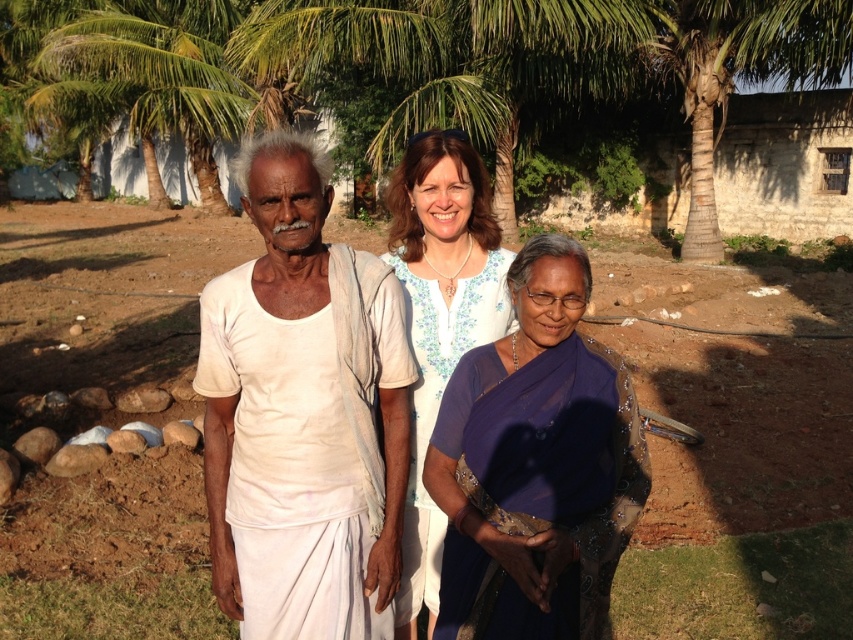
Can you confirm if purple sheer saree at center is positioned to the right of green leafy palm tree at upper left?

Yes, purple sheer saree at center is to the right of green leafy palm tree at upper left.

Can you confirm if purple sheer saree at center is positioned below green leafy palm tree at upper left?

Correct, purple sheer saree at center is located below green leafy palm tree at upper left.

Find the location of a particular element. purple sheer saree at center is located at coordinates (537, 465).

Consider the image. Can you confirm if green leafy tree at upper center is bigger than white floral dress at center?

Correct, green leafy tree at upper center is larger in size than white floral dress at center.

Looking at this image, who is positioned more to the right, green leafy tree at upper center or white floral dress at center?

Positioned to the right is white floral dress at center.

Identify the location of green leafy tree at upper center. The image size is (853, 640). (421, 64).

Can you confirm if white cotton shirt at left is thinner than white cotton shirt at center?

No, white cotton shirt at left is not thinner than white cotton shirt at center.

Does point (316, 163) come in front of point (227, 394)?

Yes.

Locate an element on the screen. This screenshot has width=853, height=640. white cotton shirt at left is located at coordinates (337, 374).